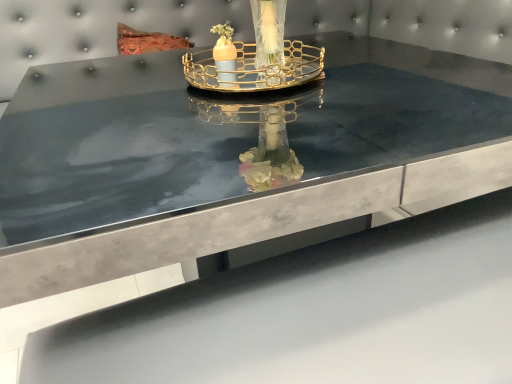
At what (x,y) coordinates should I click in order to perform the action: click on gold metallic tray at center. Please return your answer as a coordinate pair (x, y). Looking at the image, I should click on (256, 57).

The width and height of the screenshot is (512, 384). What do you see at coordinates (256, 57) in the screenshot?
I see `gold metallic tray at center` at bounding box center [256, 57].

Describe the element at coordinates (225, 61) in the screenshot. I see `matte orange candle at center` at that location.

Where is `matte orange candle at center`? The image size is (512, 384). matte orange candle at center is located at coordinates (225, 61).

Image resolution: width=512 pixels, height=384 pixels. I want to click on gold metallic tray at center, so click(256, 57).

Does gold metallic tray at center appear on the left side of matte orange candle at center?

No, gold metallic tray at center is not to the left of matte orange candle at center.

Considering the positions of objects gold metallic tray at center and matte orange candle at center in the image provided, who is behind, gold metallic tray at center or matte orange candle at center?

matte orange candle at center is further from the camera.

Is point (266, 23) positioned after point (226, 41)?

No, it is in front of (226, 41).

From the image's perspective, which object appears higher, gold metallic tray at center or matte orange candle at center?

gold metallic tray at center, from the image's perspective.

From the picture: From a real-world perspective, is gold metallic tray at center over matte orange candle at center?

Yes, from a real-world perspective, gold metallic tray at center is above matte orange candle at center.

Which of these two, gold metallic tray at center or matte orange candle at center, is thinner?

Thinner between the two is matte orange candle at center.

Between gold metallic tray at center and matte orange candle at center, which one has more height?

gold metallic tray at center is taller.

Is gold metallic tray at center smaller than matte orange candle at center?

No, gold metallic tray at center is not smaller than matte orange candle at center.

Is gold metallic tray at center outside of matte orange candle at center?

Yes, gold metallic tray at center is outside of matte orange candle at center.

Based on the photo, is gold metallic tray at center in contact with matte orange candle at center?

Yes, gold metallic tray at center is in contact with matte orange candle at center.

From the picture: Is gold metallic tray at center looking in the opposite direction of matte orange candle at center?

No, matte orange candle at center is not at the back of gold metallic tray at center.

You are a GUI agent. You are given a task and a screenshot of the screen. Output one action in this format:
    pyautogui.click(x=<x>, y=<y>)
    Task: Click on the candle holder above the matte orange candle at center (from a real-world perspective)
    The image size is (512, 384).
    Given the screenshot: What is the action you would take?
    pyautogui.click(x=256, y=57)

Based on the photo, between matte orange candle at center and gold metallic tray at center, which one appears on the right side from the viewer's perspective?

gold metallic tray at center is more to the right.

Considering the relative positions of matte orange candle at center and gold metallic tray at center in the image provided, is matte orange candle at center in front of gold metallic tray at center?

No, matte orange candle at center is further to the viewer.

Does point (234, 56) lie in front of point (273, 72)?

No, it is not.

From the image's perspective, which one is positioned higher, matte orange candle at center or gold metallic tray at center?

gold metallic tray at center appears higher in the image.

Based on the photo, from a real-world perspective, which is physically below, matte orange candle at center or gold metallic tray at center?

matte orange candle at center.

Does matte orange candle at center have a greater width compared to gold metallic tray at center?

No.

Is matte orange candle at center taller or shorter than gold metallic tray at center?

Clearly, matte orange candle at center is shorter compared to gold metallic tray at center.

Is matte orange candle at center smaller than gold metallic tray at center?

Yes, matte orange candle at center is smaller than gold metallic tray at center.

Choose the correct answer: Is matte orange candle at center inside gold metallic tray at center or outside it?

matte orange candle at center is contained in gold metallic tray at center.

Is matte orange candle at center far away from gold metallic tray at center?

matte orange candle at center is near gold metallic tray at center, not far away.

Is gold metallic tray at center at the back of matte orange candle at center?

matte orange candle at center does not have its back to gold metallic tray at center.

How many degrees apart are the facing directions of matte orange candle at center and gold metallic tray at center?

matte orange candle at center and gold metallic tray at center are facing 0.000222 degrees away from each other.

How far apart are matte orange candle at center and gold metallic tray at center?

matte orange candle at center is 3.92 inches from gold metallic tray at center.

This screenshot has width=512, height=384. I want to click on candle holder above the matte orange candle at center (from the image's perspective), so click(256, 57).

Identify the location of candle beneath the gold metallic tray at center (from a real-world perspective). The width and height of the screenshot is (512, 384). (225, 61).

This screenshot has height=384, width=512. Find the location of `candle holder on the right of the matte orange candle at center`. candle holder on the right of the matte orange candle at center is located at coordinates (256, 57).